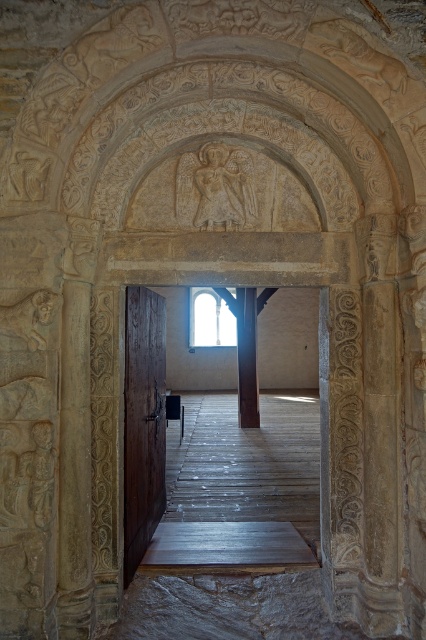
You are standing in front of the stone archway and see the brown wooden door at center and the dark wood pillar at center. Which object is located to the left of the other?

The brown wooden door at center is positioned on the left side of dark wood pillar at center, so the brown wooden door at center is to the left of the dark wood pillar at center.

You are standing in front of the stone archway and want to walk into the room. According to the wooden floor at center, where should you step to enter the room?

The wooden floor at center is located at point [144,422], so you should step towards that coordinate to enter the room.